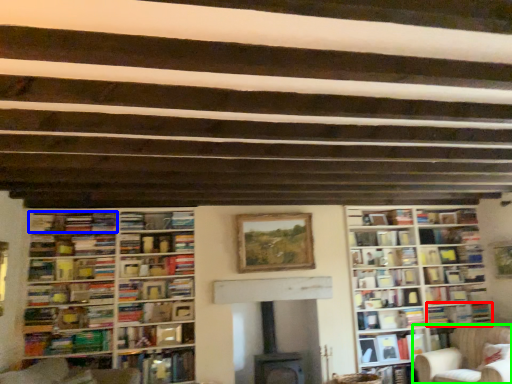
Question: Based on their relative distances, which object is nearer to book (highlighted by a red box)? Choose from book (highlighted by a blue box) and chair (highlighted by a green box).

Choices:
 (A) book
 (B) chair

Answer: (B)